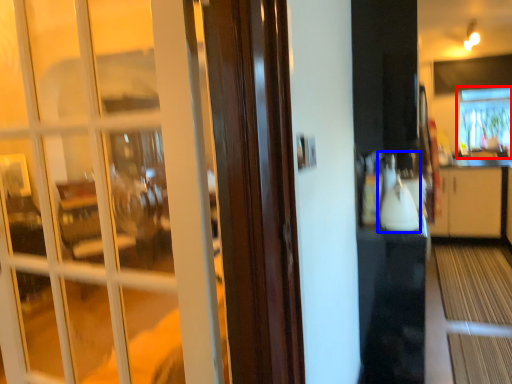
Question: Which of the following is the farthest to the observer, window (highlighted by a red box) or appliance (highlighted by a blue box)?

Choices:
 (A) window
 (B) appliance

Answer: (A)